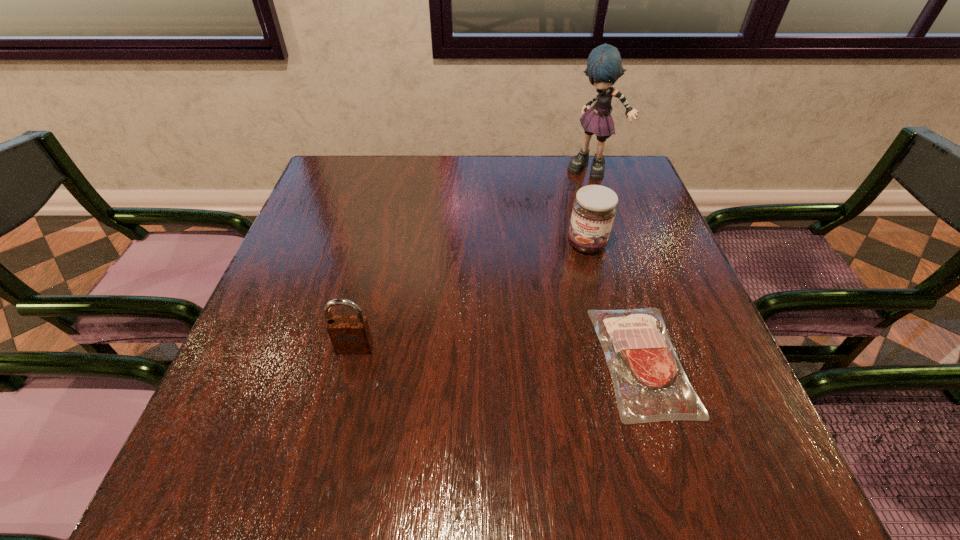
You are a GUI agent. You are given a task and a screenshot of the screen. Output one action in this format:
    pyautogui.click(x=<x>, y=<y>)
    Task: Click on the blank region between the padlock and the jam
    
    Given the screenshot: What is the action you would take?
    pyautogui.click(x=471, y=296)

The height and width of the screenshot is (540, 960). I want to click on free space between the steak and the jam, so click(x=614, y=302).

The height and width of the screenshot is (540, 960). Identify the location of vacant region between the jam and the leftmost object. (471, 296).

The height and width of the screenshot is (540, 960). In order to click on free point between the farthest object and the leftmost object in this screenshot , I will do `click(474, 259)`.

Find the location of a particular element. The width and height of the screenshot is (960, 540). free space between the leftmost object and the steak is located at coordinates (498, 354).

This screenshot has height=540, width=960. In order to click on free space between the leftmost object and the jam in this screenshot , I will do `click(471, 296)`.

Locate which object ranks second in proximity to the second farthest object. Please provide its 2D coordinates. Your answer should be formatted as a tuple, i.e. [(x, y)], where the tuple contains the x and y coordinates of a point satisfying the conditions above.

[(604, 66)]

Locate which object ranks in proximity to the second farthest object. Please provide its 2D coordinates. Your answer should be formatted as a tuple, i.e. [(x, y)], where the tuple contains the x and y coordinates of a point satisfying the conditions above.

[(650, 385)]